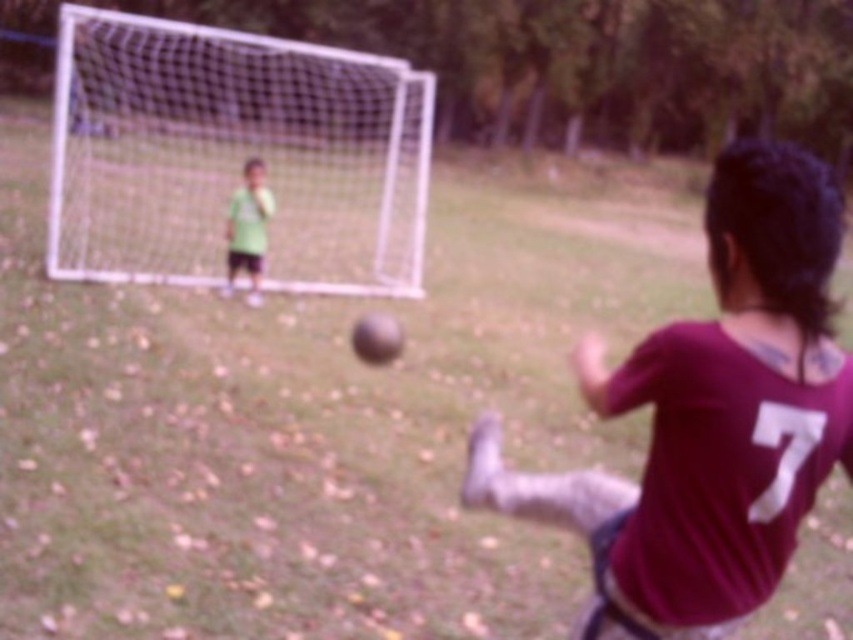
Question: Can you confirm if white mesh net at upper left is thinner than green matte shirt at upper left?

Choices:
 (A) yes
 (B) no

Answer: (B)

Question: From the image, what is the correct spatial relationship of white mesh net at upper left in relation to green matte shirt at upper left?

Choices:
 (A) below
 (B) above

Answer: (B)

Question: Does white mesh net at upper left have a smaller size compared to green matte shirt at upper left?

Choices:
 (A) yes
 (B) no

Answer: (B)

Question: Estimate the real-world distances between objects in this image. Which object is closer to the white mesh net at upper left?

Choices:
 (A) maroon jersey at center
 (B) green matte shirt at upper left

Answer: (B)

Question: Based on their relative distances, which object is nearer to the maroon jersey at center?

Choices:
 (A) green matte shirt at upper left
 (B) white mesh net at upper left

Answer: (A)

Question: Which is farther from the green matte shirt at upper left?

Choices:
 (A) white mesh net at upper left
 (B) maroon jersey at center

Answer: (A)